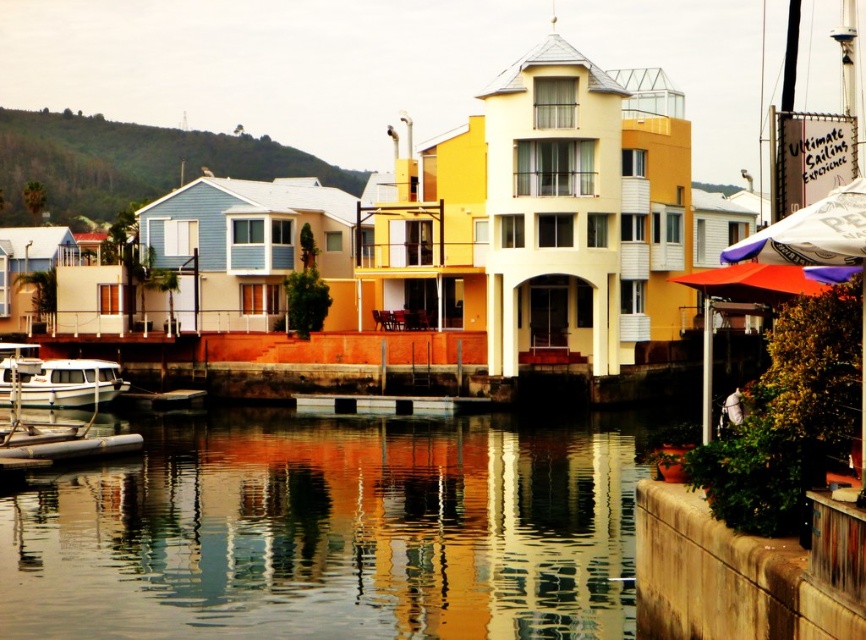
You are standing at the waterfront and want to take a photo of the white fabric umbrella at upper right without the reflective glass water at lower center in the shot. Is it possible to do so by moving closer to the umbrella?

The white fabric umbrella at upper right is behind reflective glass water at lower center, so moving closer to the umbrella would still have the reflective glass water at lower center in the shot. You need to move to the side instead.

You are standing at the waterfront in the image and want to reach the green grassy hillside at upper left. Given that the average walking speed is 1.4 meters per second, approximately how many minutes would it take to walk there?

The green grassy hillside at upper left is 211.55 meters from viewer. At an average walking speed of 1.4 meters per second, it would take approximately 151 seconds, which is about 2.5 minutes.

You are standing at the base of the green grassy hillside at upper left and want to reach the white fabric umbrella at upper right. The path between them is straight. If you walk at a constant speed of 1.5 meters per second, how long will it take you to reach the umbrella?

The distance between the green grassy hillside at upper left and the white fabric umbrella at upper right is 163.91 meters. At a speed of 1.5 meters per second, the time required would be 163.91 divided by 1.5, which equals approximately 109.27 seconds, or about 1 minute and 49 seconds.